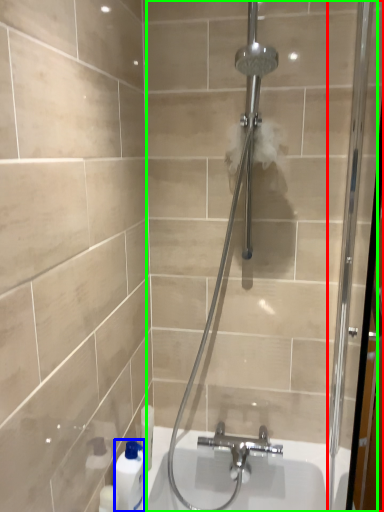
Question: Which object is the farthest from screen door (highlighted by a red box)? Choose among these: cleaning product (highlighted by a blue box) or shower door (highlighted by a green box).

Choices:
 (A) cleaning product
 (B) shower door

Answer: (A)